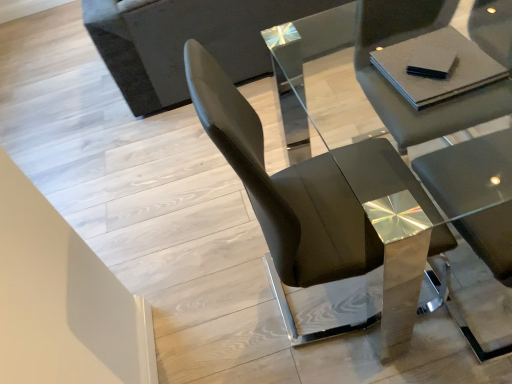
Question: In terms of height, does glossy black chair at center, the second chair from the right, look taller or shorter compared to black matte pad at upper right?

Choices:
 (A) tall
 (B) short

Answer: (A)

Question: Does point (406, 172) appear closer or farther from the camera than point (421, 69)?

Choices:
 (A) farther
 (B) closer

Answer: (A)

Question: Estimate the real-world distances between objects in this image. Which object is closer to the black matte pad at upper right?

Choices:
 (A) matte gray chair at center, the second chair in the left-to-right sequence
 (B) dark gray fabric couch at upper left
 (C) glossy black chair at center, which appears as the 1th chair when viewed from the left

Answer: (A)

Question: Which of these objects is positioned closest to the dark gray fabric couch at upper left?

Choices:
 (A) matte gray chair at center, the second chair in the left-to-right sequence
 (B) black matte pad at upper right
 (C) glossy black chair at center, which appears as the 1th chair when viewed from the left

Answer: (A)